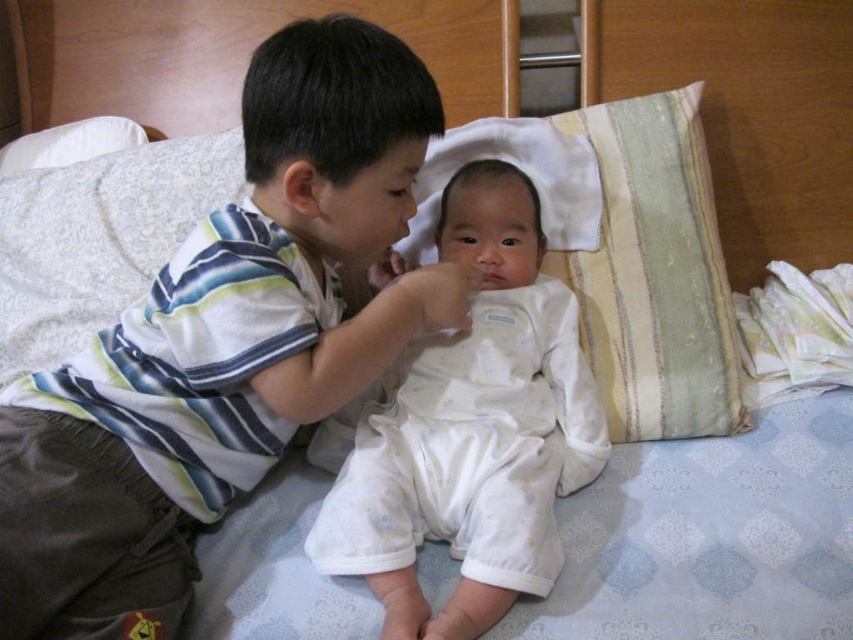
Between point (283, 282) and point (717, 433), which one is positioned behind?

Positioned behind is point (717, 433).

Does point (300, 234) come in front of point (608, 163)?

Yes, point (300, 234) is in front of point (608, 163).

The image size is (853, 640). Identify the location of striped cotton shirt at center. (224, 342).

Where is `striped cotton shirt at center`? This screenshot has height=640, width=853. striped cotton shirt at center is located at coordinates (224, 342).

Between white textured pillow at upper center and green striped pillow at upper right, which one has more height?

white textured pillow at upper center

Measure the distance between white textured pillow at upper center and camera.

white textured pillow at upper center is 1.05 meters from camera.

Locate an element on the screen. Image resolution: width=853 pixels, height=640 pixels. white textured pillow at upper center is located at coordinates (654, 272).

Image resolution: width=853 pixels, height=640 pixels. I want to click on white textured pillow at upper center, so click(654, 272).

This screenshot has height=640, width=853. In order to click on white textured pillow at upper center in this screenshot , I will do `click(654, 272)`.

Who is more forward, (691, 320) or (354, 525)?

Point (354, 525) is more forward.

This screenshot has width=853, height=640. I want to click on white textured pillow at upper center, so click(654, 272).